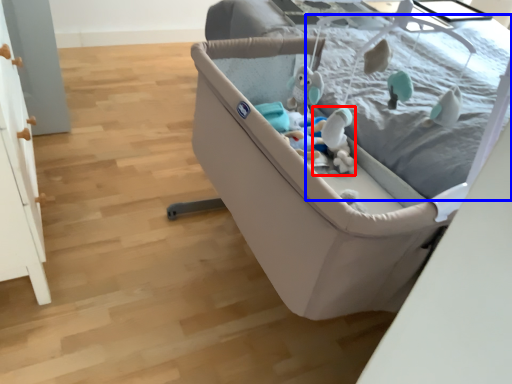
Question: Among these objects, which one is farthest to the camera, toy (highlighted by a red box) or mattress (highlighted by a blue box)?

Choices:
 (A) toy
 (B) mattress

Answer: (A)